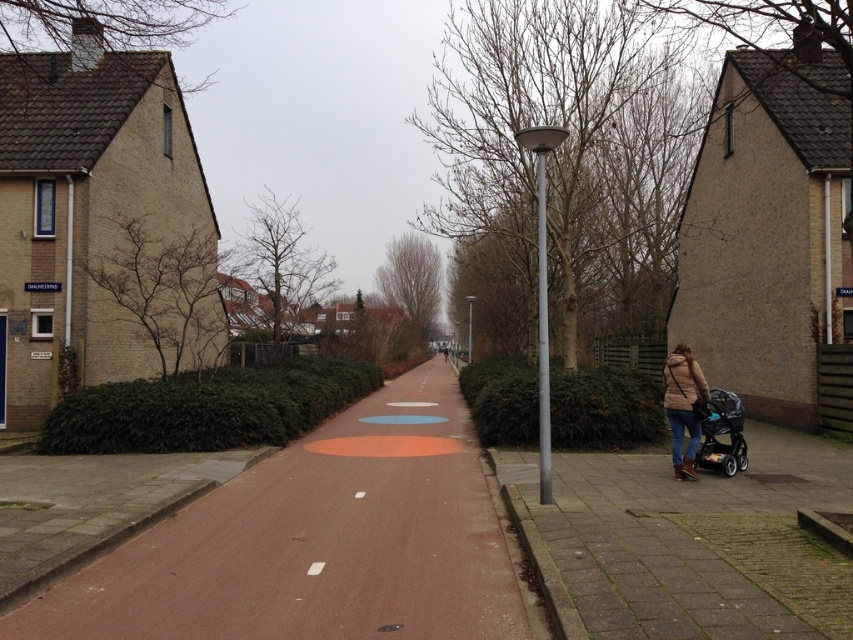
From the picture: Can you confirm if smooth concrete path at center is positioned to the right of matte brown jacket at lower right?

Incorrect, smooth concrete path at center is not on the right side of matte brown jacket at lower right.

Who is positioned more to the left, smooth concrete path at center or matte brown jacket at lower right?

smooth concrete path at center

Where is `smooth concrete path at center`? smooth concrete path at center is located at coordinates (321, 541).

In the scene shown: Is smooth concrete path at center to the right of matte black stroller at lower right from the viewer's perspective?

No, smooth concrete path at center is not to the right of matte black stroller at lower right.

Which of these two, smooth concrete path at center or matte black stroller at lower right, stands taller?

matte black stroller at lower right is taller.

Identify the location of smooth concrete path at center. The height and width of the screenshot is (640, 853). (321, 541).

Does matte brown jacket at lower right have a larger size compared to matte black stroller at lower right?

Incorrect, matte brown jacket at lower right is not larger than matte black stroller at lower right.

Consider the image. Between matte brown jacket at lower right and matte black stroller at lower right, which one has more height?

Standing taller between the two is matte black stroller at lower right.

Is point (694, 410) positioned behind point (718, 467)?

No, it is not.

This screenshot has width=853, height=640. What are the coordinates of `matte brown jacket at lower right` in the screenshot? It's located at (683, 406).